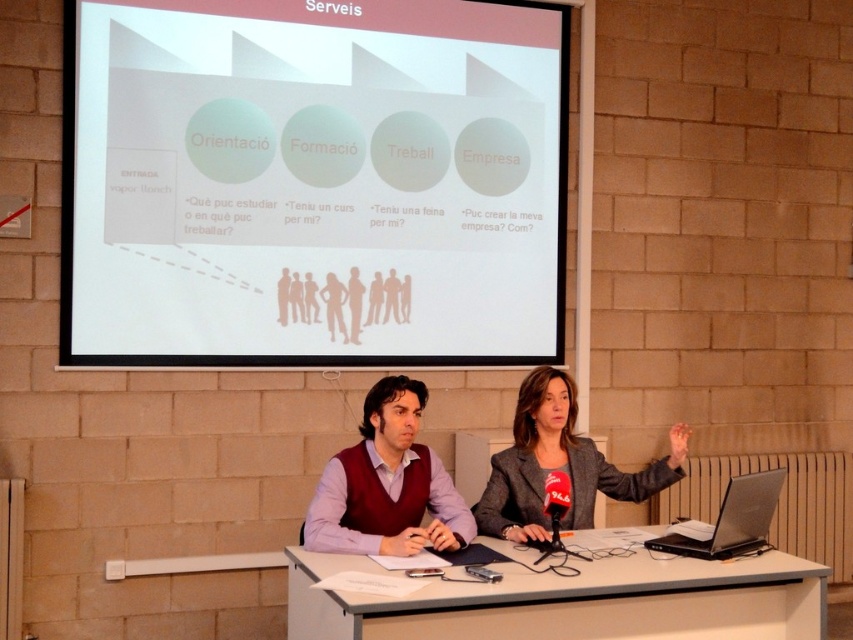
Can you confirm if brown paper cutout people at center is shorter than light brown paper cutout figure at center?

No, brown paper cutout people at center is not shorter than light brown paper cutout figure at center.

Does brown paper cutout people at center have a lesser width compared to light brown paper cutout figure at center?

Incorrect, brown paper cutout people at center's width is not less than light brown paper cutout figure at center's.

Is point (331, 317) less distant than point (369, 310)?

Yes, it is in front of point (369, 310).

At what (x,y) coordinates should I click in order to perform the action: click on brown paper cutout people at center. Please return your answer as a coordinate pair (x, y). Looking at the image, I should click on (343, 300).

Is white glossy table at center to the right of brown paper cutout people at center from the viewer's perspective?

Indeed, white glossy table at center is positioned on the right side of brown paper cutout people at center.

The image size is (853, 640). I want to click on white glossy table at center, so click(572, 602).

Is point (756, 628) less distant than point (380, 296)?

Yes, point (756, 628) is closer to viewer.

Where is `white glossy table at center`? This screenshot has height=640, width=853. white glossy table at center is located at coordinates (572, 602).

Who is taller, silver metallic laptop at center or silhouette figure at center?

With more height is silhouette figure at center.

Who is more distant from viewer, (746, 547) or (352, 317)?

Point (352, 317)

Where is `silver metallic laptop at center`? silver metallic laptop at center is located at coordinates click(x=732, y=520).